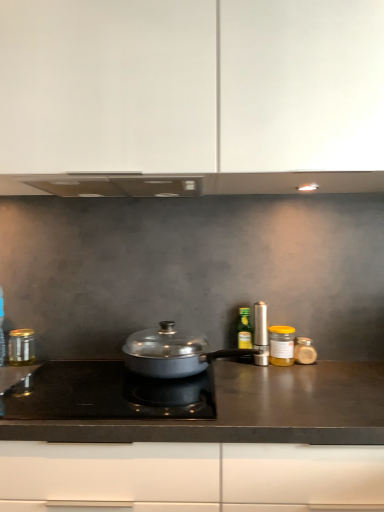
Describe the element at coordinates (261, 334) in the screenshot. The height and width of the screenshot is (512, 384). I see `silver metallic salt shaker at right, the 3th kitchen appliance positioned from the right` at that location.

Locate an element on the screen. The image size is (384, 512). matte silver pan at center, which appears as the second kitchen appliance when viewed from the left is located at coordinates (171, 352).

What is the approximate height of matte silver pan at center, which appears as the second kitchen appliance when viewed from the left?

matte silver pan at center, which appears as the second kitchen appliance when viewed from the left, is 5.80 inches tall.

Describe the element at coordinates (244, 329) in the screenshot. This screenshot has height=512, width=384. I see `metallic silver canister at center right, marked as the third kitchen appliance in a left-to-right arrangement` at that location.

At what (x,y) coordinates should I click in order to perform the action: click on black glass cooktop at center. Please return your answer as a coordinate pair (x, y). This screenshot has height=512, width=384. Looking at the image, I should click on (107, 394).

How much space does translucent glass jar at right, acting as the 6th kitchen appliance starting from the left, occupy vertically?

The height of translucent glass jar at right, acting as the 6th kitchen appliance starting from the left, is 4.25 inches.

What is the approximate width of white matte cabinet at upper center?

16.05 inches.

Measure the distance between point (232, 404) and camera.

They are 1.09 meters apart.

The width and height of the screenshot is (384, 512). I want to click on silver metallic salt shaker at right, the 3th kitchen appliance positioned from the right, so click(261, 334).

From the image's perspective, is clear glass jar at left, marked as the 1th kitchen appliance in a left-to-right arrangement, located above black matte countertop at center?

Yes.

Which object is positioned more to the right, clear glass jar at left, which appears as the sixth kitchen appliance when viewed from the right, or black matte countertop at center?

From the viewer's perspective, black matte countertop at center appears more on the right side.

Is clear glass jar at left, marked as the 1th kitchen appliance in a left-to-right arrangement, in contact with black matte countertop at center?

clear glass jar at left, marked as the 1th kitchen appliance in a left-to-right arrangement, and black matte countertop at center are not in contact.

Is clear glass jar at left, which appears as the sixth kitchen appliance when viewed from the right, positioned beyond the bounds of black matte countertop at center?

That's correct, clear glass jar at left, which appears as the sixth kitchen appliance when viewed from the right, is outside of black matte countertop at center.

Based on the photo, is metallic silver canister at center right, marked as the third kitchen appliance in a left-to-right arrangement, not near yellow glass jar at right, marked as the second kitchen appliance in a right-to-left arrangement?

metallic silver canister at center right, marked as the third kitchen appliance in a left-to-right arrangement, is actually quite close to yellow glass jar at right, marked as the second kitchen appliance in a right-to-left arrangement.

From the image's perspective, is metallic silver canister at center right, which is the fourth kitchen appliance in right-to-left order, positioned above or below yellow glass jar at right, marked as the second kitchen appliance in a right-to-left arrangement?

Clearly, from the image's perspective, metallic silver canister at center right, which is the fourth kitchen appliance in right-to-left order, is above yellow glass jar at right, marked as the second kitchen appliance in a right-to-left arrangement.

How different are the orientations of metallic silver canister at center right, which is the fourth kitchen appliance in right-to-left order, and yellow glass jar at right, the 5th kitchen appliance positioned from the left, in degrees?

metallic silver canister at center right, which is the fourth kitchen appliance in right-to-left order, and yellow glass jar at right, the 5th kitchen appliance positioned from the left, are facing 1.13 degrees away from each other.

Which of these two, metallic silver canister at center right, which is the fourth kitchen appliance in right-to-left order, or yellow glass jar at right, the 5th kitchen appliance positioned from the left, is wider?

yellow glass jar at right, the 5th kitchen appliance positioned from the left.

Visually, is white matte cabinet at upper center positioned to the left or to the right of translucent glass jar at right, which is the first kitchen appliance in right-to-left order?

white matte cabinet at upper center is positioned on translucent glass jar at right, which is the first kitchen appliance in right-to-left order,'s left side.

Is white matte cabinet at upper center facing towards translucent glass jar at right, which is the first kitchen appliance in right-to-left order?

No, white matte cabinet at upper center does not turn towards translucent glass jar at right, which is the first kitchen appliance in right-to-left order.

Can you tell me how much white matte cabinet at upper center and translucent glass jar at right, acting as the 6th kitchen appliance starting from the left, differ in facing direction?

There is a 2.17-degree angle between the facing directions of white matte cabinet at upper center and translucent glass jar at right, acting as the 6th kitchen appliance starting from the left.

From the image's perspective, is clear glass jar at left, marked as the 1th kitchen appliance in a left-to-right arrangement, above or below translucent glass jar at right, acting as the 6th kitchen appliance starting from the left?

Clearly, from the image's perspective, clear glass jar at left, marked as the 1th kitchen appliance in a left-to-right arrangement, is above translucent glass jar at right, acting as the 6th kitchen appliance starting from the left.

Is point (10, 360) positioned before point (311, 344)?

That is False.

Is clear glass jar at left, which appears as the sixth kitchen appliance when viewed from the right, far away from translucent glass jar at right, which is the first kitchen appliance in right-to-left order?

No, clear glass jar at left, which appears as the sixth kitchen appliance when viewed from the right, is not far from translucent glass jar at right, which is the first kitchen appliance in right-to-left order.

Considering the sizes of objects clear glass jar at left, which appears as the sixth kitchen appliance when viewed from the right, and translucent glass jar at right, acting as the 6th kitchen appliance starting from the left, in the image provided, who is smaller, clear glass jar at left, which appears as the sixth kitchen appliance when viewed from the right, or translucent glass jar at right, acting as the 6th kitchen appliance starting from the left,?

Smaller between the two is translucent glass jar at right, acting as the 6th kitchen appliance starting from the left.

Which is less distant, (166,348) or (269,340)?

Point (166,348)

From a real-world perspective, which kitchen appliance is the 1st one underneath the yellow glass jar at right, marked as the second kitchen appliance in a right-to-left arrangement? Please provide its 2D coordinates.

[(171, 352)]

Which is correct: matte silver pan at center, which appears as the 5th kitchen appliance when viewed from the right, is inside yellow glass jar at right, the 5th kitchen appliance positioned from the left, or outside of it?

matte silver pan at center, which appears as the 5th kitchen appliance when viewed from the right, cannot be found inside yellow glass jar at right, the 5th kitchen appliance positioned from the left.

How different are the orientations of metallic silver canister at center right, marked as the third kitchen appliance in a left-to-right arrangement, and clear glass jar at left, which appears as the sixth kitchen appliance when viewed from the right, in degrees?

They differ by 5.25 degrees in their facing directions.

The width and height of the screenshot is (384, 512). What are the coordinates of `kitchen appliance that is the 2nd object located in front of the metallic silver canister at center right, marked as the third kitchen appliance in a left-to-right arrangement` in the screenshot? It's located at click(x=21, y=347).

Looking at this image, would you say clear glass jar at left, which appears as the sixth kitchen appliance when viewed from the right, is part of metallic silver canister at center right, marked as the third kitchen appliance in a left-to-right arrangement,'s contents?

Definitely not — clear glass jar at left, which appears as the sixth kitchen appliance when viewed from the right, is not inside metallic silver canister at center right, marked as the third kitchen appliance in a left-to-right arrangement.

Considering the positions of objects metallic silver canister at center right, marked as the third kitchen appliance in a left-to-right arrangement, and clear glass jar at left, which appears as the sixth kitchen appliance when viewed from the right, in the image provided, who is more to the right, metallic silver canister at center right, marked as the third kitchen appliance in a left-to-right arrangement, or clear glass jar at left, which appears as the sixth kitchen appliance when viewed from the right,?

Positioned to the right is metallic silver canister at center right, marked as the third kitchen appliance in a left-to-right arrangement.

From a real-world perspective, does translucent glass jar at right, acting as the 6th kitchen appliance starting from the left, sit lower than metallic silver canister at center right, which is the fourth kitchen appliance in right-to-left order?

Yes, from a real-world perspective, translucent glass jar at right, acting as the 6th kitchen appliance starting from the left, is under metallic silver canister at center right, which is the fourth kitchen appliance in right-to-left order.

Which object is positioned more to the left, translucent glass jar at right, which is the first kitchen appliance in right-to-left order, or metallic silver canister at center right, which is the fourth kitchen appliance in right-to-left order?

Positioned to the left is metallic silver canister at center right, which is the fourth kitchen appliance in right-to-left order.

Based on the photo, which object is thinner, translucent glass jar at right, which is the first kitchen appliance in right-to-left order, or metallic silver canister at center right, which is the fourth kitchen appliance in right-to-left order?

Thinner between the two is metallic silver canister at center right, which is the fourth kitchen appliance in right-to-left order.

From the image's perspective, which object appears higher, translucent glass jar at right, acting as the 6th kitchen appliance starting from the left, or metallic silver canister at center right, marked as the third kitchen appliance in a left-to-right arrangement?

metallic silver canister at center right, marked as the third kitchen appliance in a left-to-right arrangement, is shown above in the image.

What are the coordinates of `kitchen appliance on the left of black matte countertop at center` in the screenshot? It's located at (21, 347).

Find the location of a particular element. The width and height of the screenshot is (384, 512). the 1st kitchen appliance above the yellow glass jar at right, the 5th kitchen appliance positioned from the left (from the image's perspective) is located at coordinates (244, 329).

From the picture: Estimate the real-world distances between objects in this image. Which object is closer to yellow glass jar at right, marked as the second kitchen appliance in a right-to-left arrangement, white matte cabinet at upper center or black glass cooktop at center?

black glass cooktop at center lies closer to yellow glass jar at right, marked as the second kitchen appliance in a right-to-left arrangement, than the other object.

Estimate the real-world distances between objects in this image. Which object is further from silver metallic salt shaker at right, the 3th kitchen appliance positioned from the right, white matte cabinet at upper center or matte silver pan at center, which appears as the 5th kitchen appliance when viewed from the right?

white matte cabinet at upper center.

Based on their spatial positions, is silver metallic salt shaker at right, the 3th kitchen appliance positioned from the right, or clear glass jar at left, which appears as the sixth kitchen appliance when viewed from the right, further from metallic silver canister at center right, which is the fourth kitchen appliance in right-to-left order?

clear glass jar at left, which appears as the sixth kitchen appliance when viewed from the right.

Looking at the image, which one is located further to translucent glass jar at right, acting as the 6th kitchen appliance starting from the left, black glass cooktop at center or yellow glass jar at right, marked as the second kitchen appliance in a right-to-left arrangement?

black glass cooktop at center.

From the image, which object appears to be nearer to black matte countertop at center, yellow glass jar at right, the 5th kitchen appliance positioned from the left, or black glass cooktop at center?

black glass cooktop at center lies closer to black matte countertop at center than the other object.

Looking at the image, which one is located closer to translucent glass jar at right, acting as the 6th kitchen appliance starting from the left, black glass cooktop at center or metallic silver canister at center right, which is the fourth kitchen appliance in right-to-left order?

The object closer to translucent glass jar at right, acting as the 6th kitchen appliance starting from the left, is metallic silver canister at center right, which is the fourth kitchen appliance in right-to-left order.

Considering their positions, is translucent glass jar at right, acting as the 6th kitchen appliance starting from the left, positioned closer to yellow glass jar at right, marked as the second kitchen appliance in a right-to-left arrangement, than matte silver pan at center, which appears as the second kitchen appliance when viewed from the left?

translucent glass jar at right, acting as the 6th kitchen appliance starting from the left, is positioned closer to the anchor yellow glass jar at right, marked as the second kitchen appliance in a right-to-left arrangement.

When comparing their distances from metallic silver canister at center right, marked as the third kitchen appliance in a left-to-right arrangement, does matte silver pan at center, which appears as the second kitchen appliance when viewed from the left, or black glass cooktop at center seem further?

Based on the image, black glass cooktop at center appears to be further to metallic silver canister at center right, marked as the third kitchen appliance in a left-to-right arrangement.

At what (x,y) coordinates should I click in order to perform the action: click on gas stove between clear glass jar at left, marked as the 1th kitchen appliance in a left-to-right arrangement, and silver metallic salt shaker at right, the 3th kitchen appliance positioned from the right. Please return your answer as a coordinate pair (x, y). The width and height of the screenshot is (384, 512). Looking at the image, I should click on (107, 394).

Identify the location of countertop between black glass cooktop at center and yellow glass jar at right, marked as the second kitchen appliance in a right-to-left arrangement. The width and height of the screenshot is (384, 512). (252, 410).

Where is `gas stove located between clear glass jar at left, marked as the 1th kitchen appliance in a left-to-right arrangement, and black matte countertop at center in the left-right direction`? This screenshot has width=384, height=512. gas stove located between clear glass jar at left, marked as the 1th kitchen appliance in a left-to-right arrangement, and black matte countertop at center in the left-right direction is located at coordinates (107, 394).

Where is `kitchen appliance between black matte countertop at center and silver metallic salt shaker at right, which is counted as the fourth kitchen appliance, starting from the left, along the z-axis`? kitchen appliance between black matte countertop at center and silver metallic salt shaker at right, which is counted as the fourth kitchen appliance, starting from the left, along the z-axis is located at coordinates (171, 352).